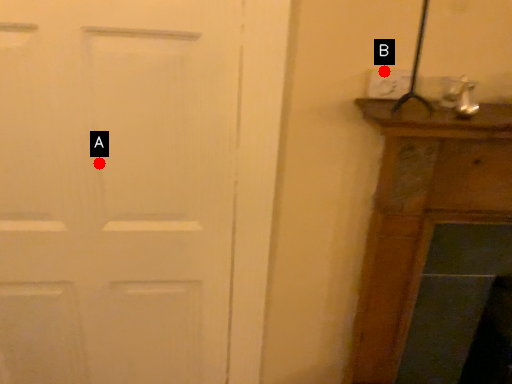
Question: Two points are circled on the image, labeled by A and B beside each circle. Which of the following is the closest to the observer?

Choices:
 (A) A is closer
 (B) B is closer

Answer: (B)